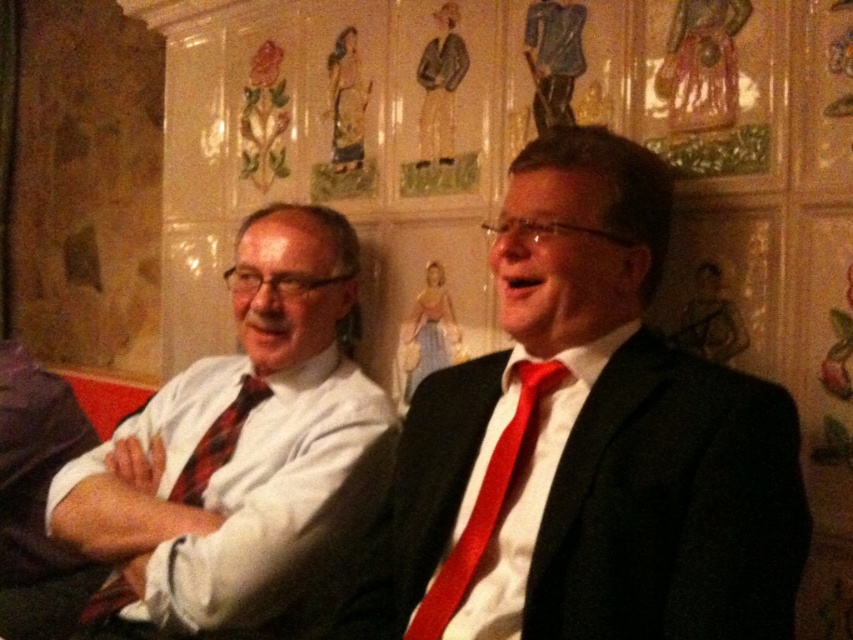
You are a photographer setting up a shoot in this scene. You need to ensure that the matte black suit at center and the red satin tie at right are both visible in the frame. Given their sizes, which object should you focus on to ensure both are in focus?

The matte black suit at center has a greater height compared to the red satin tie at right, so focusing on the larger matte black suit at center will help ensure both objects are in focus.

You are a photographer setting up a shoot. You need to ensure that the matte black suit at center and the red satin tie at right are both visible in the frame. Based on their positions, which object is closer to the camera?

The matte black suit at center is positioned over the red satin tie at right, so it is closer to the camera.

You are a photographer standing 2 feet away from the camera. You want to adjust the focus on the matte black suit at center. Can you reach it without moving the camera?

The matte black suit at center and camera are 30.99 inches apart from each other. Since you are standing 2 feet away from the camera, which is 24 inches, the distance between you and the matte black suit at center would be 24 inches plus 30.99 inches, totaling 54.99 inches. Therefore, you cannot reach the matte black suit at center without moving the camera as it is out of your arm reach.